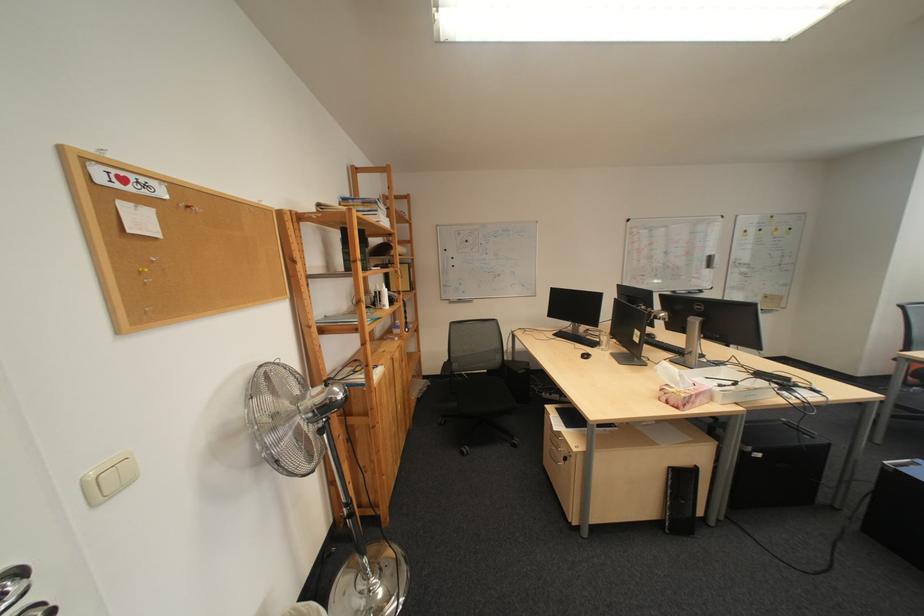
Locate an element on the screen. The width and height of the screenshot is (924, 616). white spray bottle is located at coordinates (383, 297).